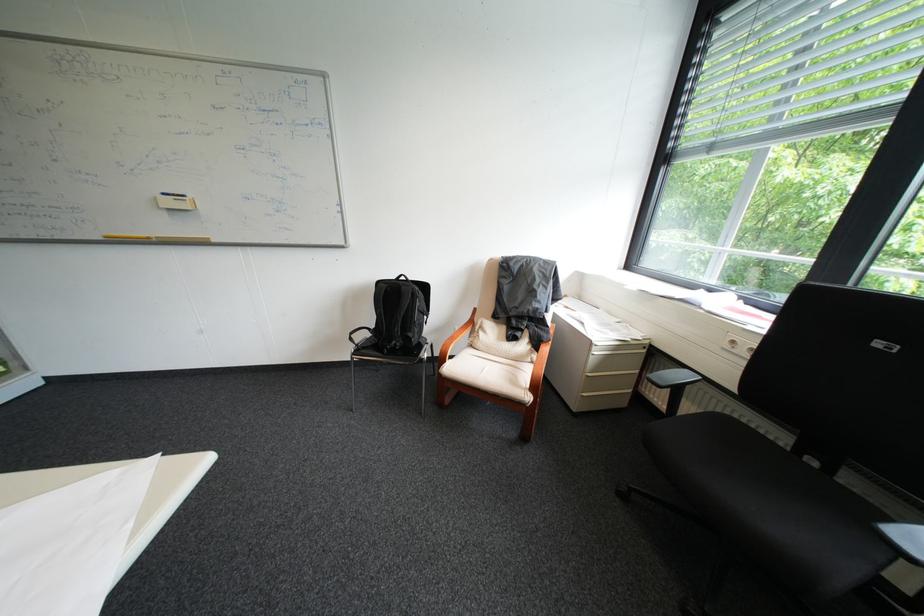
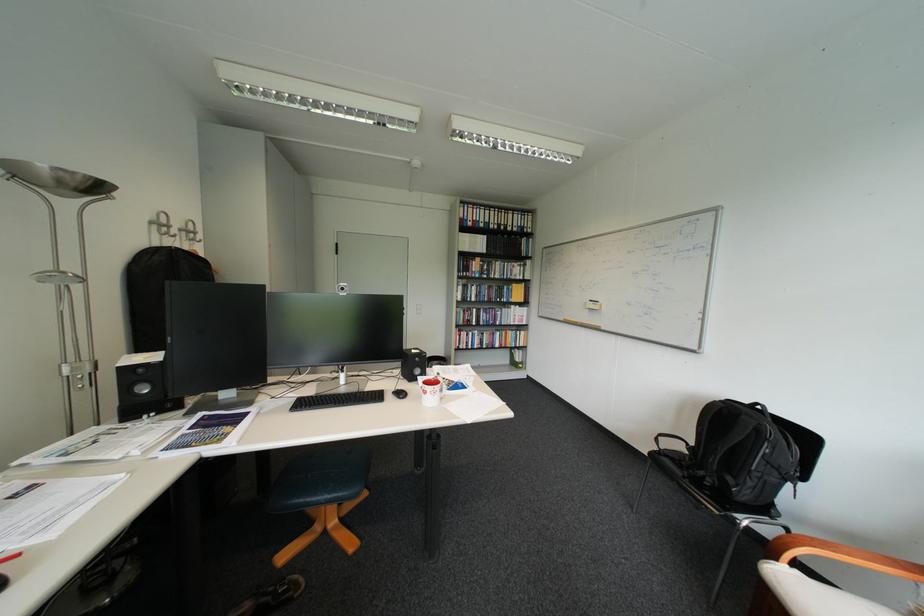
The point at [456,363] is marked in the first image. Where is the corresponding point in the second image?

(788, 560)